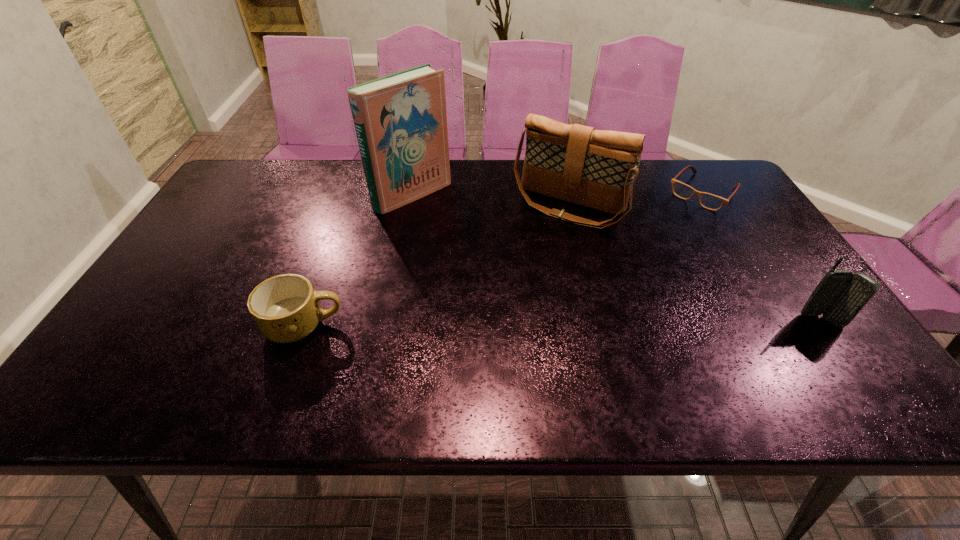
I want to click on vacant spot on the desktop that is between the mug and the third tallest object and is positioned on the front-facing side of the third object from right to left, so click(493, 324).

This screenshot has width=960, height=540. What are the coordinates of `free space on the desktop that is between the fourth tallest object and the cellular telephone and is positioned on the cover of the hardback book` in the screenshot? It's located at (582, 323).

I want to click on vacant space on the desktop that is between the mug and the cellular telephone and is positioned on the front-facing side of the spectacles, so click(582, 323).